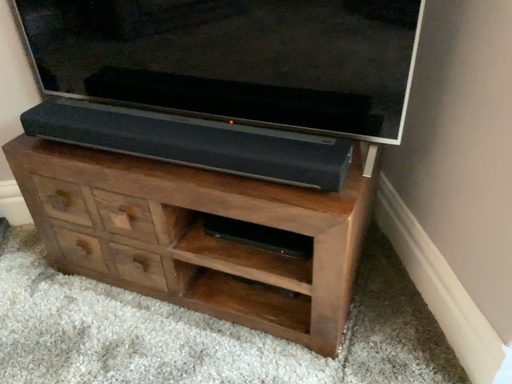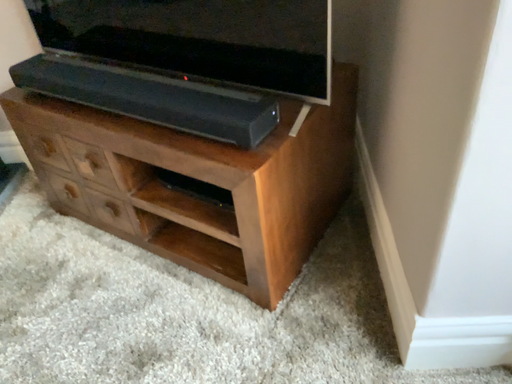
Question: Which way did the camera rotate in the video?

Choices:
 (A) rotated left
 (B) rotated right

Answer: (A)